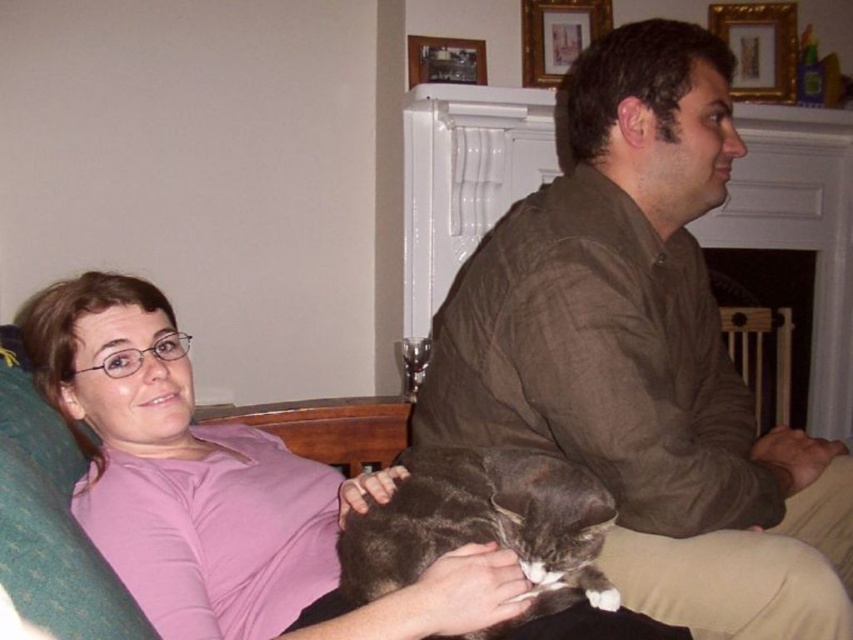
Who is positioned more to the right, gold/glass picture frame at upper center or gold-framed picture at upper center?

gold/glass picture frame at upper center is more to the right.

Is gold/glass picture frame at upper center taller than gold-framed picture at upper center?

Correct, gold/glass picture frame at upper center is much taller as gold-framed picture at upper center.

Between point (752, 86) and point (546, 6), which one is positioned in front?

Point (546, 6) is in front.

The height and width of the screenshot is (640, 853). Identify the location of gold/glass picture frame at upper center. (759, 48).

Does brown textured shirt at center have a greater width compared to gold-framed picture at upper center?

Yes.

Between brown textured shirt at center and gold-framed picture at upper center, which one appears on the right side from the viewer's perspective?

Positioned to the right is gold-framed picture at upper center.

Is point (612, 467) closer to camera compared to point (590, 22)?

Yes, point (612, 467) is closer to viewer.

Locate an element on the screen. The width and height of the screenshot is (853, 640). brown textured shirt at center is located at coordinates (x=643, y=356).

Identify the location of brown textured shirt at center. (643, 356).

Is brown textured shirt at center above gray fur cat at center?

Correct, brown textured shirt at center is located above gray fur cat at center.

Which is in front, point (608, 406) or point (563, 584)?

Point (563, 584)

Where is `brown textured shirt at center`? brown textured shirt at center is located at coordinates (643, 356).